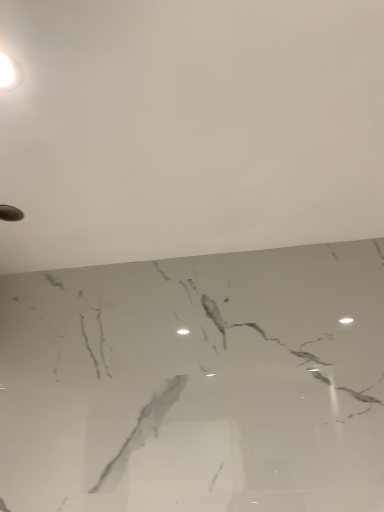
Locate an element on the screen. This screenshot has width=384, height=512. white glossy light fixture at upper left is located at coordinates (9, 73).

The width and height of the screenshot is (384, 512). What do you see at coordinates (9, 73) in the screenshot?
I see `white glossy light fixture at upper left` at bounding box center [9, 73].

Where is `white marble floor at lower center`? Image resolution: width=384 pixels, height=512 pixels. white marble floor at lower center is located at coordinates (189, 128).

Measure the distance between point (122, 135) and camera.

They are 33.46 inches apart.

This screenshot has width=384, height=512. Describe the element at coordinates (189, 128) in the screenshot. I see `white marble floor at lower center` at that location.

What are the coordinates of `white glossy light fixture at upper left` in the screenshot? It's located at (9, 73).

Considering the relative positions of white marble floor at lower center and white glossy light fixture at upper left in the image provided, is white marble floor at lower center to the left of white glossy light fixture at upper left from the viewer's perspective?

In fact, white marble floor at lower center is to the right of white glossy light fixture at upper left.

Who is more distant, white marble floor at lower center or white glossy light fixture at upper left?

Positioned behind is white glossy light fixture at upper left.

Which is farther from the camera, (274, 64) or (0, 52)?

The point (274, 64) is farther from the camera.

In the scene shown: From the image's perspective, is white marble floor at lower center beneath white glossy light fixture at upper left?

Indeed, from the image's perspective, white marble floor at lower center is shown beneath white glossy light fixture at upper left.

From a real-world perspective, is white marble floor at lower center over white glossy light fixture at upper left?

Yes, from a real-world perspective, white marble floor at lower center is on top of white glossy light fixture at upper left.

Is white marble floor at lower center wider or thinner than white glossy light fixture at upper left?

Clearly, white marble floor at lower center has more width compared to white glossy light fixture at upper left.

Does white marble floor at lower center have a greater height compared to white glossy light fixture at upper left?

Yes, white marble floor at lower center is taller than white glossy light fixture at upper left.

Does white marble floor at lower center have a smaller size compared to white glossy light fixture at upper left?

No, white marble floor at lower center is not smaller than white glossy light fixture at upper left.

Would you say white marble floor at lower center is inside or outside white glossy light fixture at upper left?

white marble floor at lower center exists outside the volume of white glossy light fixture at upper left.

Is the surface of white marble floor at lower center in direct contact with white glossy light fixture at upper left?

No.

Is white marble floor at lower center positioned with its back to white glossy light fixture at upper left?

Correct, white marble floor at lower center is looking away from white glossy light fixture at upper left.

In the scene shown: How different are the orientations of white marble floor at lower center and white glossy light fixture at upper left in degrees?

There is a 89.4-degree angle between the facing directions of white marble floor at lower center and white glossy light fixture at upper left.

Where is `backdrop located below the white glossy light fixture at upper left (from the image's perspective)`? This screenshot has width=384, height=512. backdrop located below the white glossy light fixture at upper left (from the image's perspective) is located at coordinates (189, 128).

Which object is positioned more to the right, white glossy light fixture at upper left or white marble floor at lower center?

white marble floor at lower center is more to the right.

Who is more distant, white glossy light fixture at upper left or white marble floor at lower center?

white glossy light fixture at upper left.

Which point is more distant from viewer, (x=1, y=63) or (x=45, y=259)?

The point (x=45, y=259) is behind.

From the image's perspective, would you say white glossy light fixture at upper left is shown under white marble floor at lower center?

Actually, white glossy light fixture at upper left appears above white marble floor at lower center in the image.

From a real-world perspective, is white glossy light fixture at upper left positioned over white marble floor at lower center based on gravity?

Incorrect, from a real-world perspective, white glossy light fixture at upper left is lower than white marble floor at lower center.

Between white glossy light fixture at upper left and white marble floor at lower center, which one has smaller width?

white glossy light fixture at upper left.

Is white glossy light fixture at upper left taller or shorter than white marble floor at lower center?

Considering their sizes, white glossy light fixture at upper left has less height than white marble floor at lower center.

Considering the relative sizes of white glossy light fixture at upper left and white marble floor at lower center in the image provided, is white glossy light fixture at upper left bigger than white marble floor at lower center?

No, white glossy light fixture at upper left is not bigger than white marble floor at lower center.

Is white glossy light fixture at upper left not inside white marble floor at lower center?

That's incorrect, white glossy light fixture at upper left is not completely outside white marble floor at lower center.

Is white glossy light fixture at upper left directly adjacent to white marble floor at lower center?

A: There is a gap between white glossy light fixture at upper left and white marble floor at lower center.

Is white glossy light fixture at upper left oriented away from white marble floor at lower center?

Yes, white marble floor at lower center is at the back of white glossy light fixture at upper left.

What's the angular difference between white glossy light fixture at upper left and white marble floor at lower center's facing directions?

white glossy light fixture at upper left and white marble floor at lower center are facing 89.4 degrees away from each other.

How much distance is there between white glossy light fixture at upper left and white marble floor at lower center?

They are 41.02 centimeters apart.

Find the location of `backdrop in front of the white glossy light fixture at upper left`. backdrop in front of the white glossy light fixture at upper left is located at coordinates (189, 128).

At what (x,y) coordinates should I click in order to perform the action: click on backdrop in front of the white glossy light fixture at upper left. Please return your answer as a coordinate pair (x, y). This screenshot has width=384, height=512. Looking at the image, I should click on (189, 128).

The height and width of the screenshot is (512, 384). Find the location of `backdrop on the right of white glossy light fixture at upper left`. backdrop on the right of white glossy light fixture at upper left is located at coordinates click(x=189, y=128).